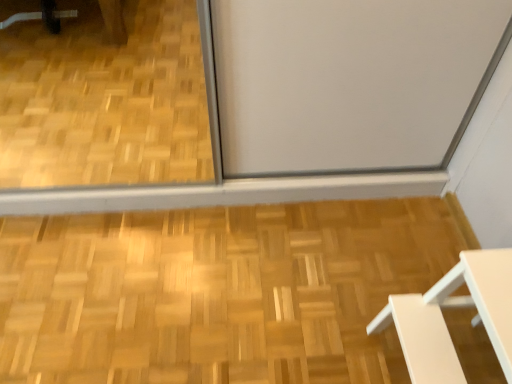
Describe the element at coordinates (453, 306) in the screenshot. I see `white matte table at lower right` at that location.

Where is `white matte table at lower right`? white matte table at lower right is located at coordinates (453, 306).

In order to click on white matte table at lower right in this screenshot , I will do `click(453, 306)`.